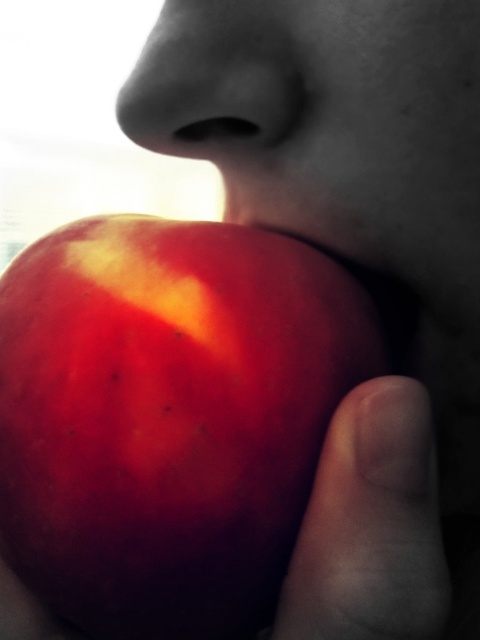
Is shiny red apple at mouth below smooth skin finger at lower right?

No.

Describe the element at coordinates (168, 417) in the screenshot. I see `shiny red apple at mouth` at that location.

Is point (113, 586) positioned after point (402, 536)?

Yes, it is.

At what (x,y) coordinates should I click in order to perform the action: click on shiny red apple at mouth. Please return your answer as a coordinate pair (x, y). This screenshot has width=480, height=640. Looking at the image, I should click on (168, 417).